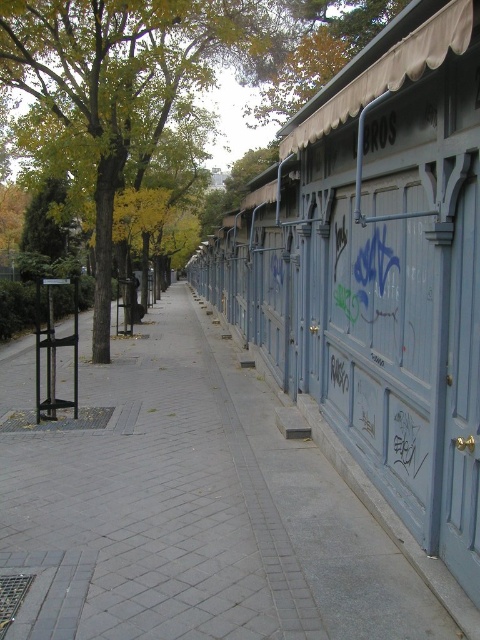
Question: Where is blue painted wood shed at right located in relation to green leafy tree at upper left in the image?

Choices:
 (A) right
 (B) left

Answer: (A)

Question: Is blue painted wood shed at right above green leafy tree at upper left?

Choices:
 (A) no
 (B) yes

Answer: (A)

Question: Which object is the closest to the blue painted wood shed at right?

Choices:
 (A) gray brick pavement at center
 (B) green leafy tree at upper left

Answer: (A)

Question: Does gray brick pavement at center come in front of green leafy tree at upper left?

Choices:
 (A) yes
 (B) no

Answer: (A)

Question: Which is farther from the gray brick pavement at center?

Choices:
 (A) green leafy tree at upper left
 (B) blue painted wood shed at right

Answer: (A)

Question: Which object is the closest to the blue painted wood shed at right?

Choices:
 (A) green leafy tree at upper left
 (B) gray brick pavement at center

Answer: (B)